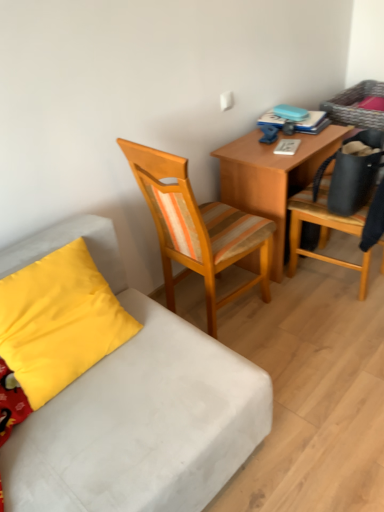
The width and height of the screenshot is (384, 512). In order to click on vacant region in front of woodenchair at center, the first chair positioned from the left in this screenshot , I will do `click(284, 367)`.